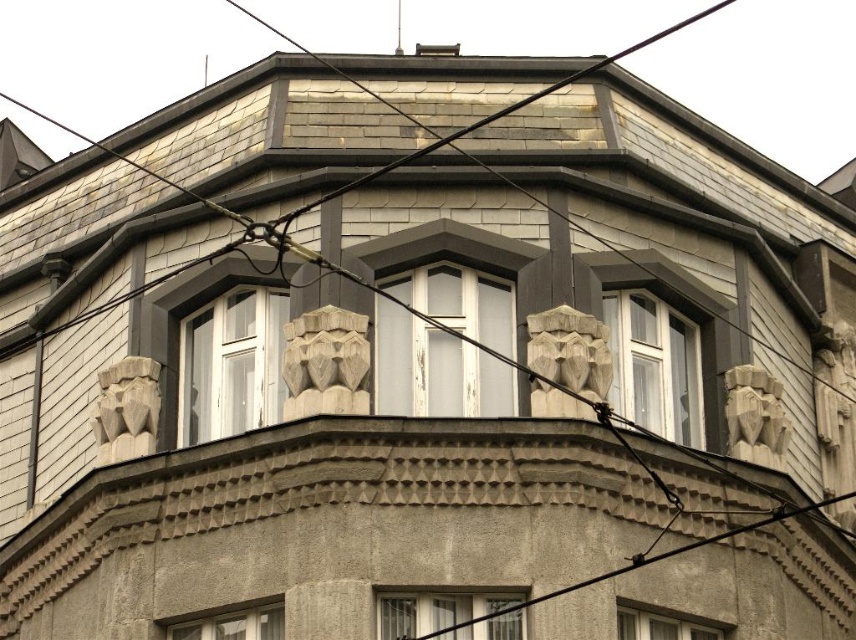
You are an architect analyzing the building facade. You see the gray stone sculpture at upper right and the matte gray window at lower left. Which object is located to the right of the other?

The gray stone sculpture at upper right is positioned on the right side of the matte gray window at lower left.

You are an architect examining the building facade. You notice the transparent glass window at center and the carved stone lion head at center. Which object is positioned to the right of the other?

The transparent glass window at center is to the right of the carved stone lion head at center.